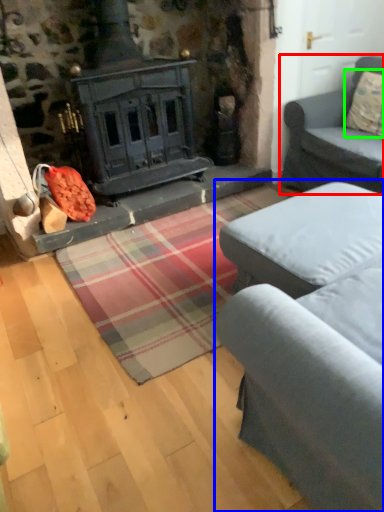
Question: Which object is the farthest from studio couch (highlighted by a red box)? Choose among these: studio couch (highlighted by a blue box) or pillow (highlighted by a green box).

Choices:
 (A) studio couch
 (B) pillow

Answer: (A)